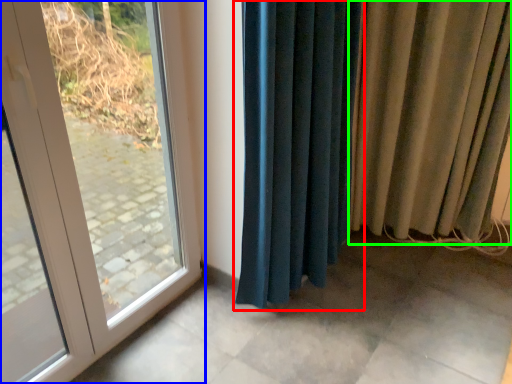
Question: Which object is the closest to the curtain (highlighted by a red box)? Choose among these: door (highlighted by a blue box) or curtain (highlighted by a green box).

Choices:
 (A) door
 (B) curtain

Answer: (B)